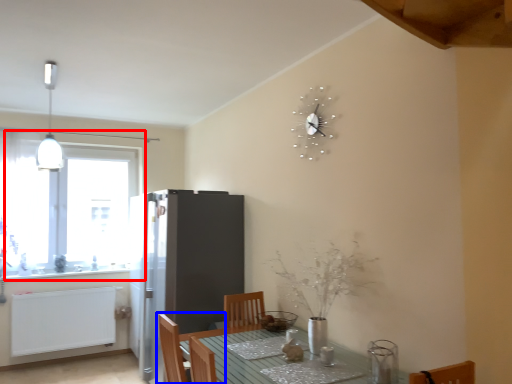
Question: Which of the following is the closest to the observer, window (highlighted by a red box) or chair (highlighted by a blue box)?

Choices:
 (A) window
 (B) chair

Answer: (B)